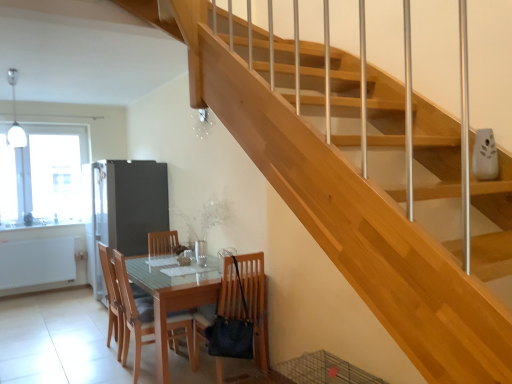
Question: Could you tell me if transparent glass window at upper left is facing light wood/wooden chair at lower left, which is the first chair from left to right?

Choices:
 (A) no
 (B) yes

Answer: (B)

Question: From the image's perspective, is transparent glass window at upper left beneath light wood/wooden chair at lower left, which is the first chair from left to right?

Choices:
 (A) no
 (B) yes

Answer: (A)

Question: Would you say light wood/wooden chair at lower left, the third chair in the right-to-left sequence, is part of transparent glass window at upper left's contents?

Choices:
 (A) no
 (B) yes

Answer: (A)

Question: From a real-world perspective, is transparent glass window at upper left positioned over light wood/wooden chair at lower left, which is the first chair from left to right, based on gravity?

Choices:
 (A) no
 (B) yes

Answer: (B)

Question: Is transparent glass window at upper left positioned before light wood/wooden chair at lower left, which is the first chair from left to right?

Choices:
 (A) yes
 (B) no

Answer: (B)

Question: Can you confirm if transparent glass window at upper left is bigger than light wood/wooden chair at lower left, which is the first chair from left to right?

Choices:
 (A) yes
 (B) no

Answer: (A)

Question: Is satin silver refrigerator at left shorter than light wood/wooden chair at lower left, the third chair in the right-to-left sequence?

Choices:
 (A) yes
 (B) no

Answer: (B)

Question: Is satin silver refrigerator at left positioned in front of light wood/wooden chair at lower left, which is the first chair from left to right?

Choices:
 (A) yes
 (B) no

Answer: (B)

Question: Is satin silver refrigerator at left smaller than light wood/wooden chair at lower left, which is the first chair from left to right?

Choices:
 (A) no
 (B) yes

Answer: (A)

Question: From the image's perspective, is satin silver refrigerator at left under light wood/wooden chair at lower left, the third chair in the right-to-left sequence?

Choices:
 (A) yes
 (B) no

Answer: (B)

Question: Does satin silver refrigerator at left have a larger size compared to light wood/wooden chair at lower left, which is the first chair from left to right?

Choices:
 (A) no
 (B) yes

Answer: (B)

Question: From a real-world perspective, is satin silver refrigerator at left on top of light wood/wooden chair at lower left, the third chair in the right-to-left sequence?

Choices:
 (A) yes
 (B) no

Answer: (A)

Question: Is light brown wood chair at center, which ranks as the 2th chair in left-to-right order, next to transparent glass window at upper left?

Choices:
 (A) no
 (B) yes

Answer: (A)